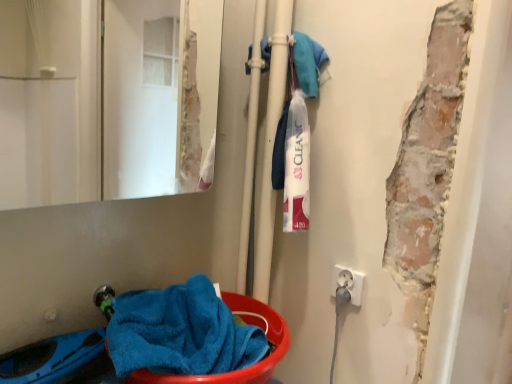
Question: Is white plastic electrical outlet at lower right at the right side of blue soft towel at lower left?

Choices:
 (A) no
 (B) yes

Answer: (B)

Question: Is white plastic electrical outlet at lower right turned away from blue soft towel at lower left?

Choices:
 (A) yes
 (B) no

Answer: (B)

Question: Could you tell me if white plastic electrical outlet at lower right is facing blue soft towel at lower left?

Choices:
 (A) yes
 (B) no

Answer: (A)

Question: Can you confirm if white plastic electrical outlet at lower right is shorter than blue soft towel at lower left?

Choices:
 (A) yes
 (B) no

Answer: (A)

Question: Is blue soft towel at lower left completely or partially inside white plastic electrical outlet at lower right?

Choices:
 (A) no
 (B) yes

Answer: (A)

Question: From a real-world perspective, is white plastic electrical outlet at lower right above or below matte glass mirror at upper left?

Choices:
 (A) below
 (B) above

Answer: (A)

Question: Considering the positions of white plastic electrical outlet at lower right and matte glass mirror at upper left in the image, is white plastic electrical outlet at lower right bigger or smaller than matte glass mirror at upper left?

Choices:
 (A) big
 (B) small

Answer: (B)

Question: Relative to matte glass mirror at upper left, is white plastic electrical outlet at lower right in front or behind?

Choices:
 (A) front
 (B) behind

Answer: (B)

Question: From the image's perspective, is white plastic electrical outlet at lower right positioned above or below matte glass mirror at upper left?

Choices:
 (A) above
 (B) below

Answer: (B)

Question: Is blue soft towel at lower left inside the boundaries of matte glass mirror at upper left, or outside?

Choices:
 (A) outside
 (B) inside

Answer: (A)

Question: Is blue soft towel at lower left wider or thinner than matte glass mirror at upper left?

Choices:
 (A) thin
 (B) wide

Answer: (B)

Question: From the image's perspective, is blue soft towel at lower left located above or below matte glass mirror at upper left?

Choices:
 (A) above
 (B) below

Answer: (B)

Question: Based on their sizes in the image, would you say blue soft towel at lower left is bigger or smaller than matte glass mirror at upper left?

Choices:
 (A) big
 (B) small

Answer: (B)

Question: From the image's perspective, relative to blue soft towel at lower left, is white plastic electrical outlet at lower right above or below?

Choices:
 (A) below
 (B) above

Answer: (B)

Question: Considering the positions of white plastic electrical outlet at lower right and blue soft towel at lower left in the image, is white plastic electrical outlet at lower right wider or thinner than blue soft towel at lower left?

Choices:
 (A) thin
 (B) wide

Answer: (A)